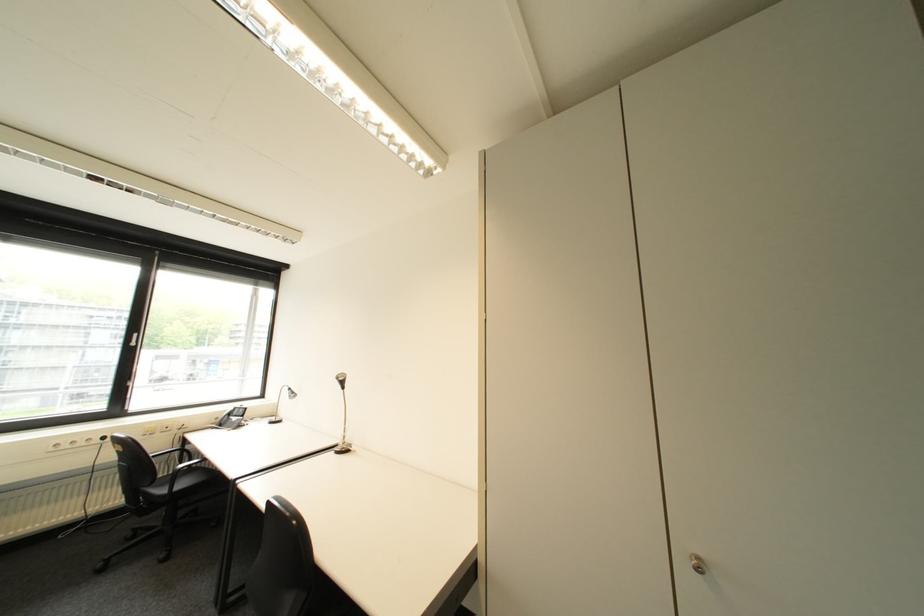
Find where to sit the chair sitting surface. Please return your answer as a coordinate pair (x, y).

(195, 474)